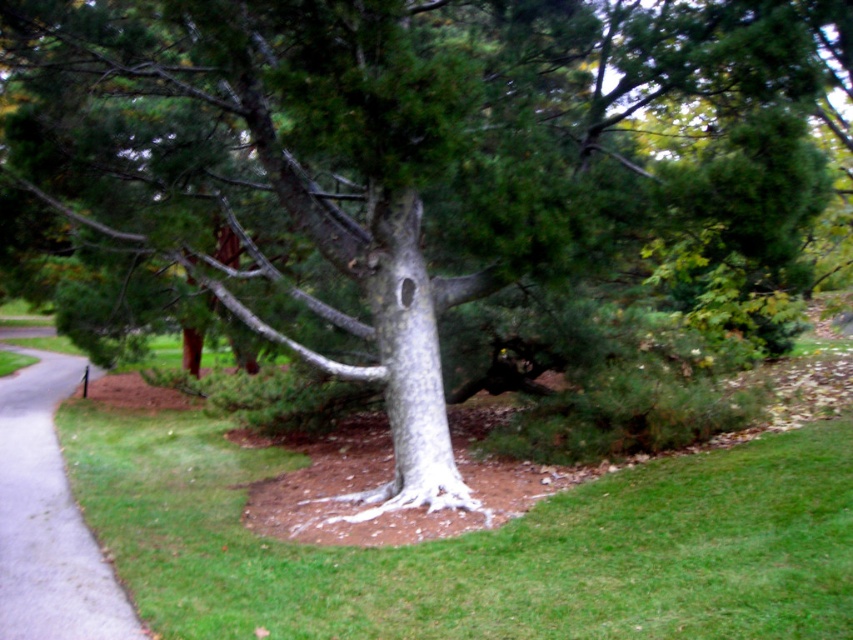
You are a gardener who needs to place a 4.2 meter long wooden fence panel between the gray asphalt pavement at lower left and the white textured bark at center. Will the fence panel fit in the available space?

The distance between the gray asphalt pavement at lower left and the white textured bark at center is 3.84 meters. Since the fence panel is 4.2 meters long, it is longer than the available space, so it will not fit.

You are a gardener planning to plant a new flower bed near the gray asphalt pavement at lower left and the white textured bark at center. Which object should you avoid digging near to protect the tree?

You should avoid digging near the white textured bark at center to protect the tree, as the gray asphalt pavement at lower left is positioned under it, indicating the tree roots may be located beneath the pavement.